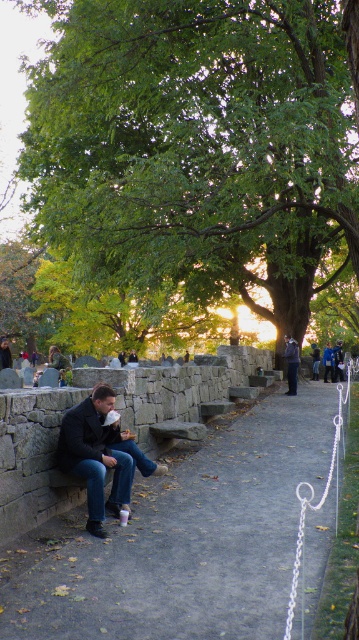
Is matte stone bench at center above blue denim jeans at center?

Actually, matte stone bench at center is below blue denim jeans at center.

Is matte stone bench at center shorter than blue denim jeans at center?

Yes, matte stone bench at center is shorter than blue denim jeans at center.

Between point (260, 616) and point (334, 378), which one is positioned behind?

Point (334, 378)

Find the location of `matte stone bench at center`. matte stone bench at center is located at coordinates (185, 540).

Which is above, matte black jacket at left or green fabric jacket at center?

matte black jacket at left is higher up.

Is matte black jacket at left above green fabric jacket at center?

Correct, matte black jacket at left is located above green fabric jacket at center.

Which is in front, point (67, 470) or point (62, 358)?

Point (67, 470) is in front.

Where is `matte black jacket at left`? matte black jacket at left is located at coordinates (94, 452).

Is green leafy tree at upper center positioned behind matte black jacket at left?

No, it is in front of matte black jacket at left.

Does green leafy tree at upper center appear on the right side of matte black jacket at left?

Correct, you'll find green leafy tree at upper center to the right of matte black jacket at left.

Which is in front, point (213, 108) or point (91, 476)?

Positioned in front is point (91, 476).

At what (x,y) coordinates should I click in order to perform the action: click on green leafy tree at upper center. Please return your answer as a coordinate pair (x, y). Looking at the image, I should click on (193, 140).